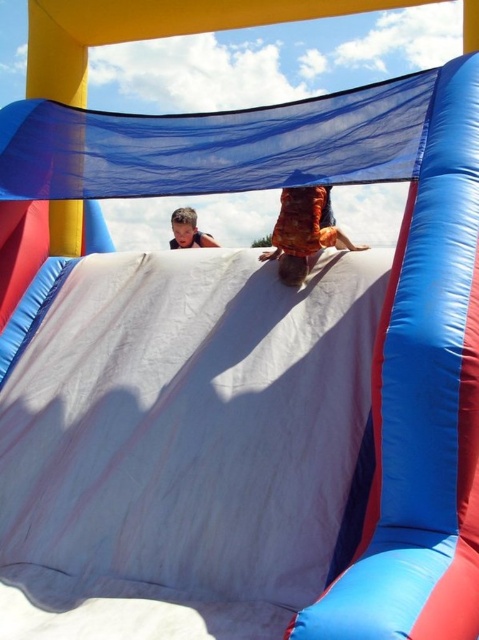
Question: Can you confirm if orange cotton shirt at center is positioned to the right of light brown hair at upper center?

Choices:
 (A) yes
 (B) no

Answer: (A)

Question: Does orange cotton shirt at center lie behind light brown hair at upper center?

Choices:
 (A) yes
 (B) no

Answer: (B)

Question: Based on their relative distances, which object is nearer to the light brown hair at upper center?

Choices:
 (A) blue fabric slide at upper center
 (B) orange cotton shirt at center

Answer: (B)

Question: Is orange cotton shirt at center below light brown hair at upper center?

Choices:
 (A) no
 (B) yes

Answer: (B)

Question: Which of the following is the closest to the observer?

Choices:
 (A) light brown hair at upper center
 (B) blue fabric slide at upper center

Answer: (B)

Question: Which object is farther from the camera taking this photo?

Choices:
 (A) blue fabric slide at upper center
 (B) light brown hair at upper center

Answer: (B)